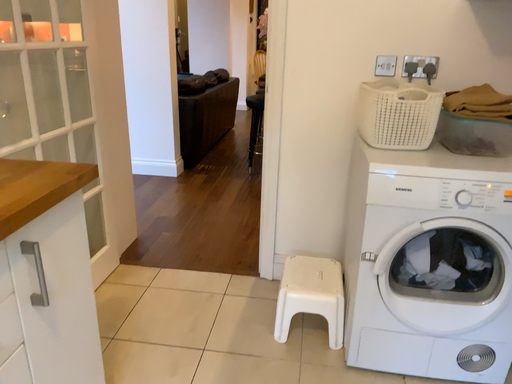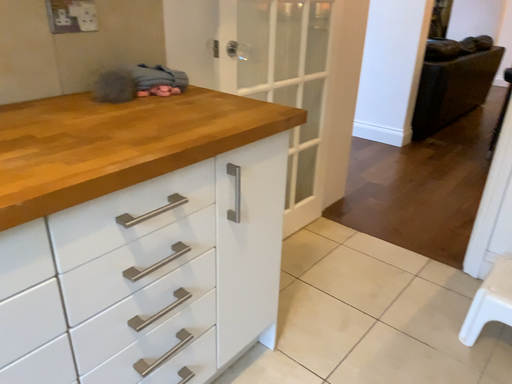
Question: How did the camera likely rotate when shooting the video?

Choices:
 (A) rotated right
 (B) rotated left

Answer: (B)